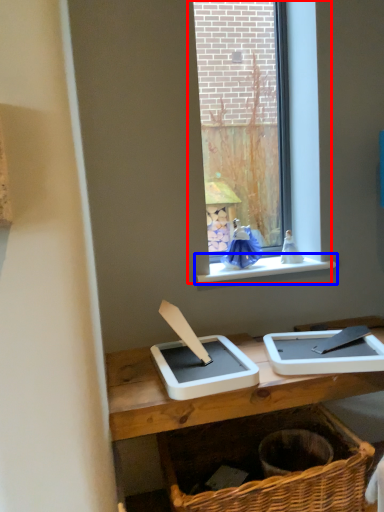
Question: Which of the following is the closest to the observer, window (highlighted by a red box) or window sill (highlighted by a blue box)?

Choices:
 (A) window
 (B) window sill

Answer: (B)